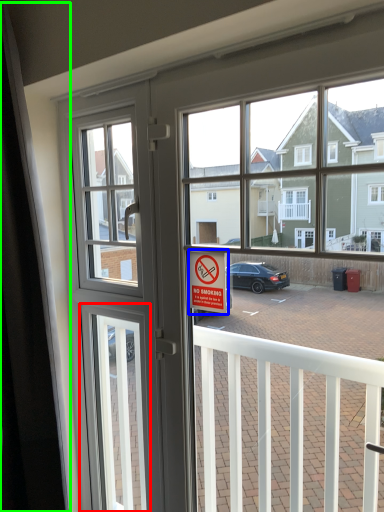
Question: Which object is the closest to the screen door (highlighted by a red box)? Choose among these: parking sign (highlighted by a blue box) or curtain (highlighted by a green box).

Choices:
 (A) parking sign
 (B) curtain

Answer: (B)